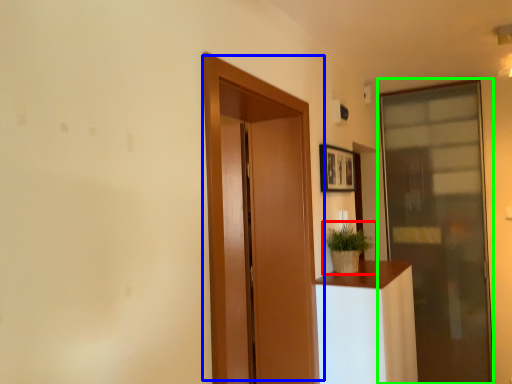
Question: Which is farther away from houseplant (highlighted by a red box)? door (highlighted by a blue box) or door (highlighted by a green box)?

Choices:
 (A) door
 (B) door

Answer: (B)